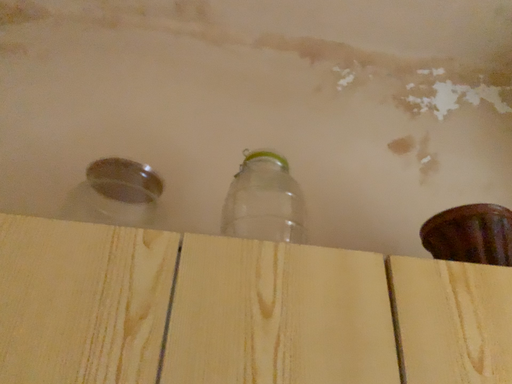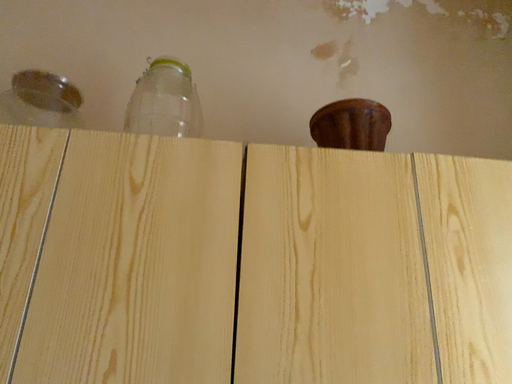
Question: Which way did the camera rotate in the video?

Choices:
 (A) rotated upward
 (B) rotated downward

Answer: (B)